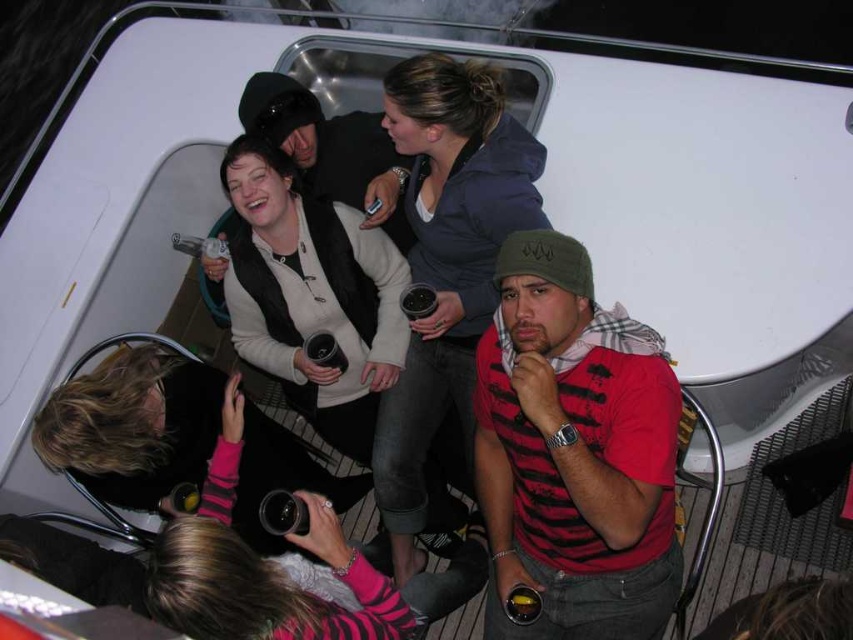
Between point (392, 490) and point (283, 141), which one is positioned in front?

Point (392, 490) is more forward.

Who is more distant from viewer, (402, 435) or (361, 209)?

Positioned behind is point (361, 209).

Identify the location of dark gray hoodie at upper center. This screenshot has width=853, height=640. (445, 262).

From the picture: Is red striped shirt at center wider than white matte sweater at center?

No.

Does point (618, 572) come in front of point (381, 339)?

Yes, point (618, 572) is closer to viewer.

In order to click on red striped shirt at center in this screenshot , I will do `click(572, 458)`.

Can you confirm if red striped shirt at center is smaller than dark gray hoodie at upper center?

Yes.

Between red striped shirt at center and dark gray hoodie at upper center, which one appears on the right side from the viewer's perspective?

red striped shirt at center

Between point (668, 532) and point (457, 305), which one is positioned in front?

Point (668, 532) is in front.

Image resolution: width=853 pixels, height=640 pixels. Identify the location of red striped shirt at center. (572, 458).